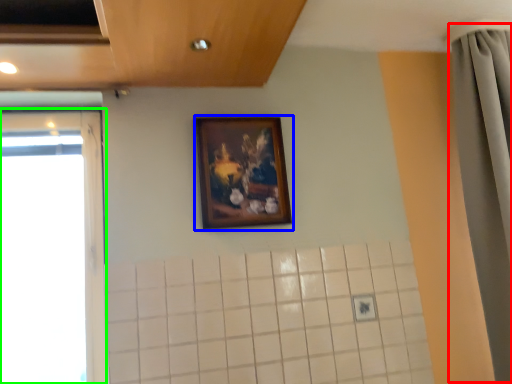
Question: Which object is positioned closest to shower curtain (highlighted by a red box)? Select from picture frame (highlighted by a blue box) and window (highlighted by a green box).

Choices:
 (A) picture frame
 (B) window

Answer: (A)